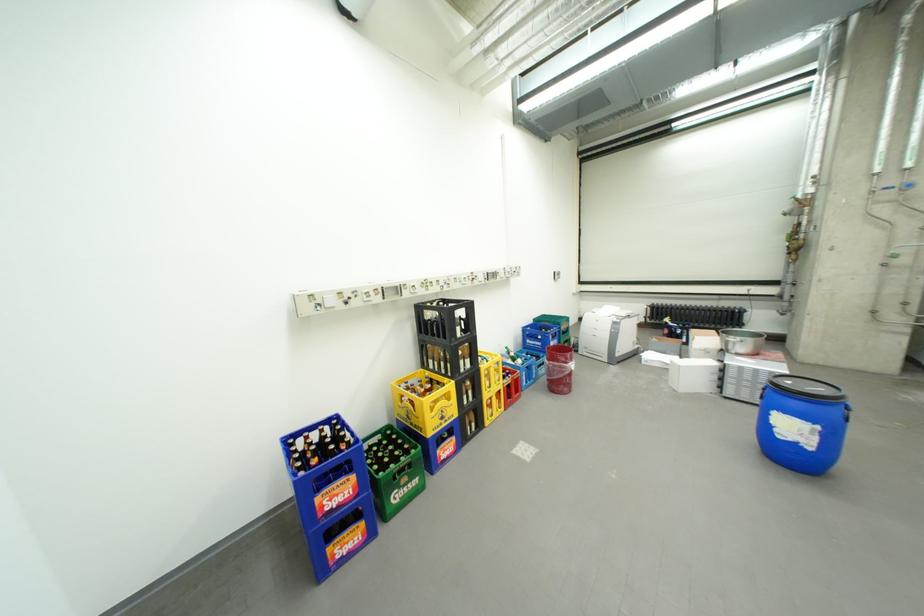
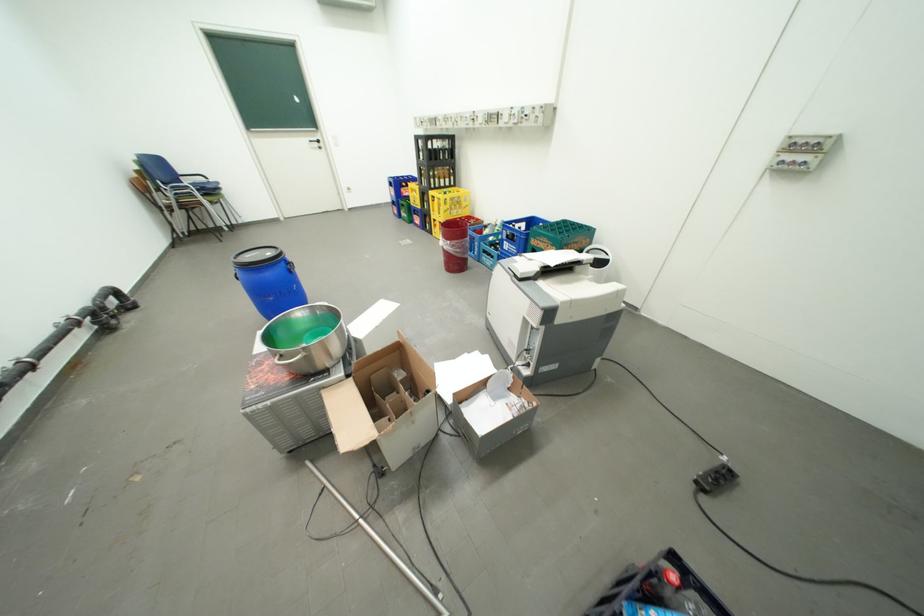
Question: I am providing you with two images of the same scene from different viewpoints. After the viewpoint changes to image2, which objects are now occluded?

Choices:
 (A) black barrel lid
 (B) bird embroidery hoop
 (C) green bottle crate
 (D) black door handle

Answer: (A)